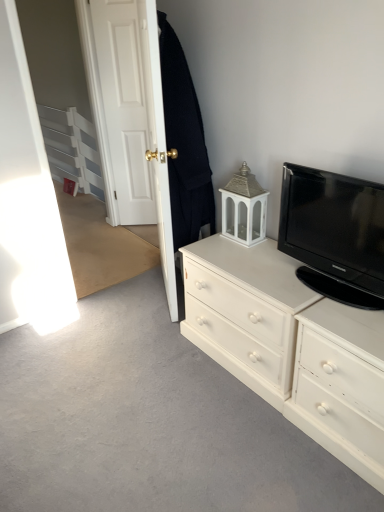
What are the coordinates of `blank space above white painted wood chest of drawers at right (from a real-world perspective)` in the screenshot? It's located at (253, 261).